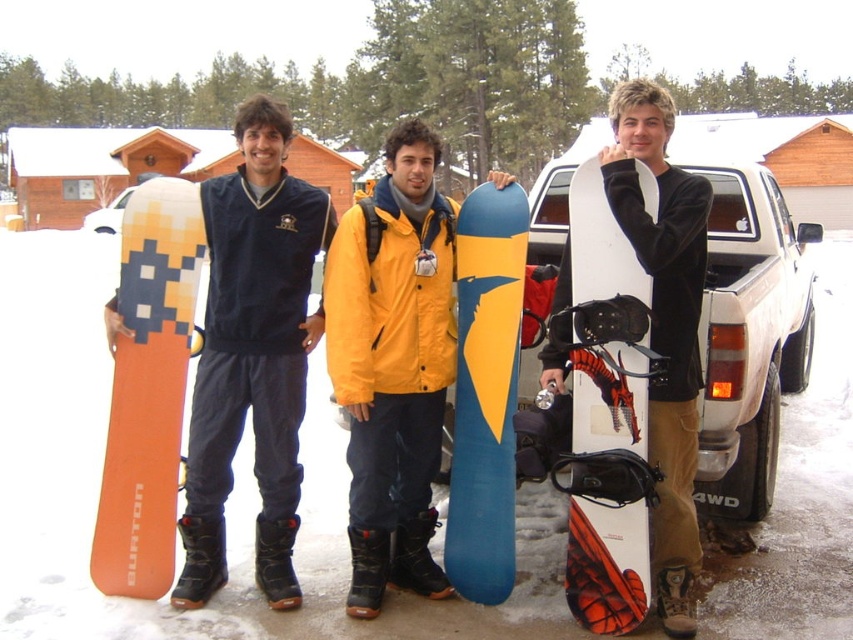
Question: Which of the following is the closest to the observer?

Choices:
 (A) (628, 444)
 (B) (131, 262)
 (C) (405, 356)

Answer: (A)

Question: Is matte orange snowboard at left closer to camera compared to blue matte snowboard at center?

Choices:
 (A) no
 (B) yes

Answer: (B)

Question: In this image, where is yellow matte snowboard at center located relative to orange matte snowboard at left?

Choices:
 (A) below
 (B) above

Answer: (B)

Question: Based on their relative distances, which object is farther from the matte orange snowboard at left?

Choices:
 (A) yellow matte snowboard at center
 (B) white matte snowboard at right
 (C) blue matte snowboard at center

Answer: (B)

Question: Does matte orange snowboard at left appear on the left side of white matte snowboard at right?

Choices:
 (A) no
 (B) yes

Answer: (B)

Question: Considering the real-world distances, which object is closest to the white matte snowboard at right?

Choices:
 (A) yellow matte snowboard at center
 (B) orange matte snowboard at left

Answer: (A)